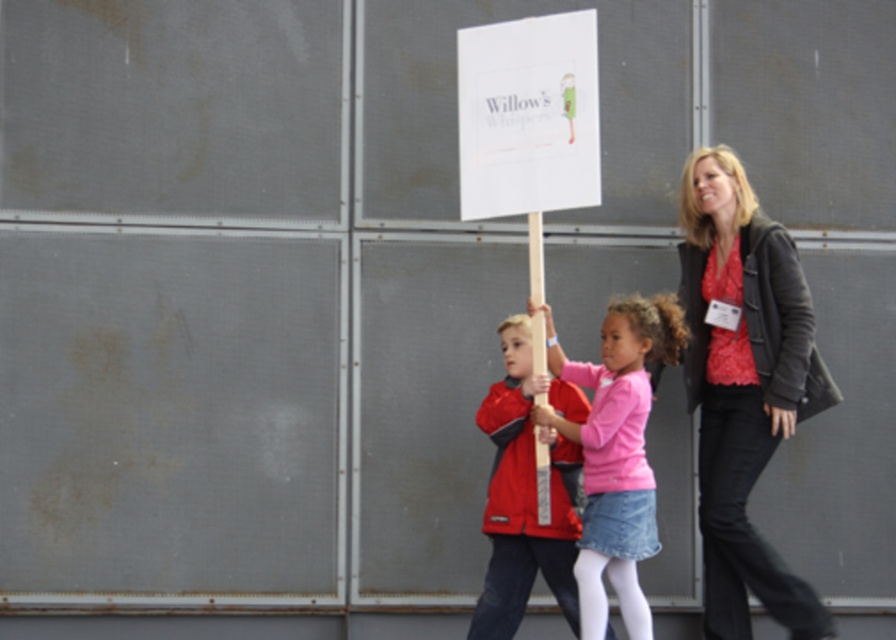
Who is taller, white paper sign at center or wooden pole at center?

wooden pole at center

Is white paper sign at center positioned before wooden pole at center?

Yes, white paper sign at center is in front of wooden pole at center.

At what (x,y) coordinates should I click in order to perform the action: click on white paper sign at center. Please return your answer as a coordinate pair (x, y). This screenshot has width=896, height=640. Looking at the image, I should click on (528, 115).

Measure the distance from matte black jacket at right to pink matte shirt at center.

matte black jacket at right is 16.66 inches away from pink matte shirt at center.

Between matte black jacket at right and pink matte shirt at center, which one is positioned lower?

pink matte shirt at center is lower down.

Is point (714, 458) positioned behind point (675, 300)?

Yes.

At what (x,y) coordinates should I click in order to perform the action: click on matte black jacket at right. Please return your answer as a coordinate pair (x, y). Looking at the image, I should click on (744, 387).

Can you confirm if matte black jacket at right is positioned to the left of wooden pole at center?

In fact, matte black jacket at right is to the right of wooden pole at center.

In the scene shown: Does matte black jacket at right appear on the right side of wooden pole at center?

Yes, matte black jacket at right is to the right of wooden pole at center.

What do you see at coordinates (744, 387) in the screenshot? I see `matte black jacket at right` at bounding box center [744, 387].

Where is `matte black jacket at right`? The width and height of the screenshot is (896, 640). matte black jacket at right is located at coordinates (744, 387).